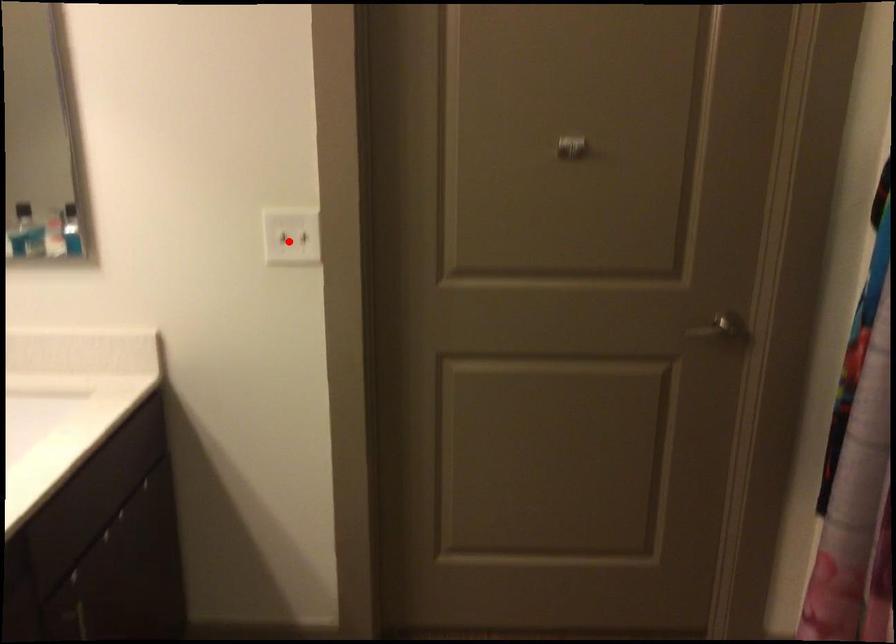
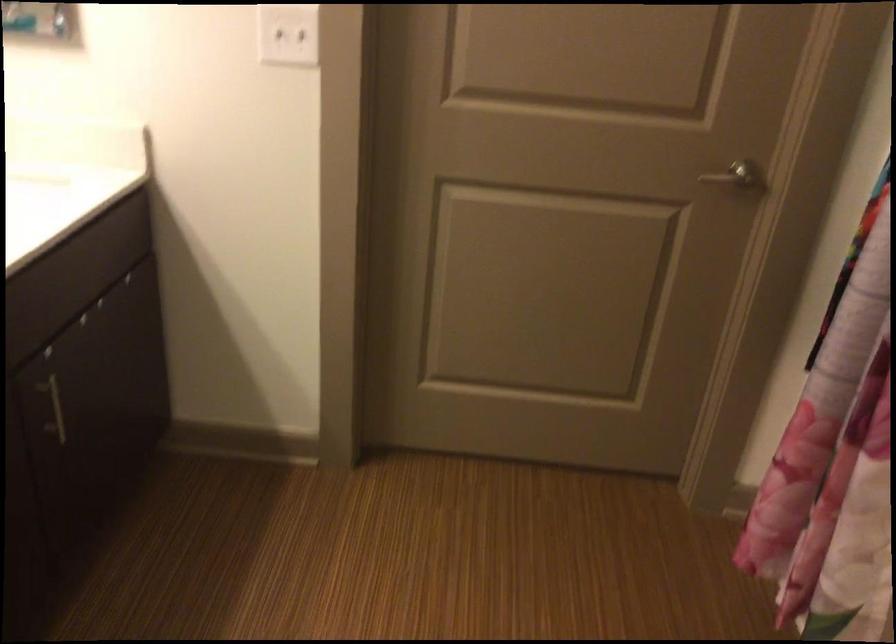
Find the pixel in the second image that matches the highlighted location in the first image.

(288, 35)